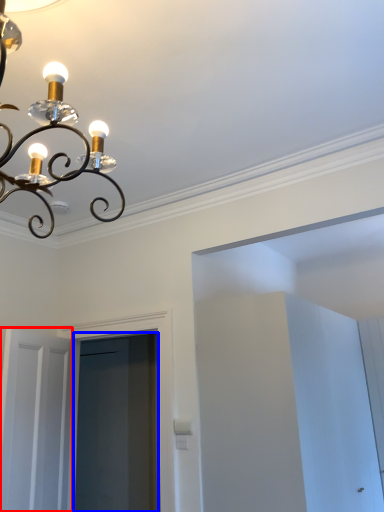
Question: Which point is further to the camera, door (highlighted by a red box) or screen door (highlighted by a blue box)?

Choices:
 (A) door
 (B) screen door

Answer: (B)